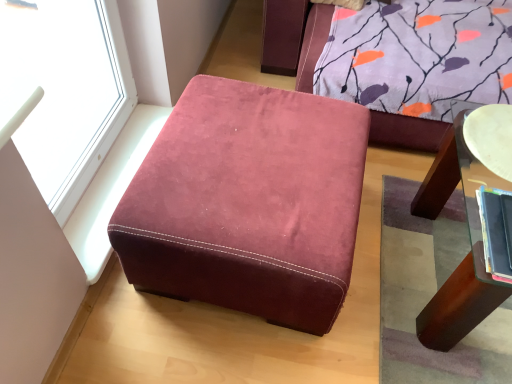
Question: From the image's perspective, is white glossy plate at upper right above or below hardcover book at right?

Choices:
 (A) below
 (B) above

Answer: (B)

Question: Considering the positions of point (490, 117) and point (499, 256), is point (490, 117) closer or farther from the camera than point (499, 256)?

Choices:
 (A) closer
 (B) farther

Answer: (B)

Question: Which is farther from the hardcover book at right?

Choices:
 (A) transparent glass window at upper left
 (B) white glossy plate at upper right
 (C) suede-like burgundy ottoman at center

Answer: (A)

Question: Which of these objects is positioned farthest from the hardcover book at right?

Choices:
 (A) suede-like burgundy ottoman at center
 (B) white glossy plate at upper right
 (C) transparent glass window at upper left

Answer: (C)